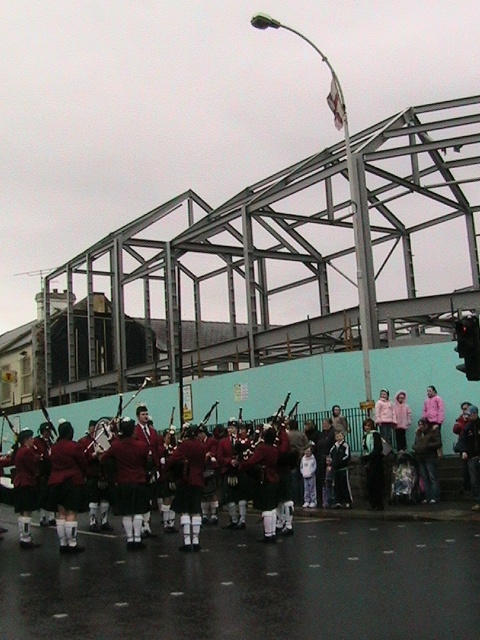
Question: Does pink fabric at center appear under brass shiny bagpipes at center?

Choices:
 (A) no
 (B) yes

Answer: (A)

Question: Among these points, which one is nearest to the camera?

Choices:
 (A) (128, 452)
 (B) (444, 500)

Answer: (A)

Question: Is shiny red bagpipes at center closer to camera compared to pink fabric at center?

Choices:
 (A) yes
 (B) no

Answer: (A)

Question: Which object appears farthest from the camera in this image?

Choices:
 (A) pink fabric at center
 (B) maroon woolen kilt at center
 (C) shiny red bagpipes at center

Answer: (A)

Question: Which object is closer to the camera taking this photo?

Choices:
 (A) red woolen sweater at center
 (B) shiny red bagpipes at center

Answer: (A)

Question: Observing the image, what is the correct spatial positioning of maroon woolen jackets at center in reference to red woolen sweater at center?

Choices:
 (A) below
 (B) above

Answer: (A)